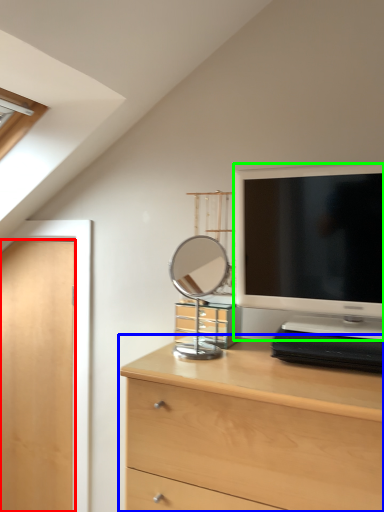
Question: Estimate the real-world distances between objects in this image. Which object is closer to door (highlighted by a red box), chest of drawers (highlighted by a blue box) or television (highlighted by a green box)?

Choices:
 (A) chest of drawers
 (B) television

Answer: (A)